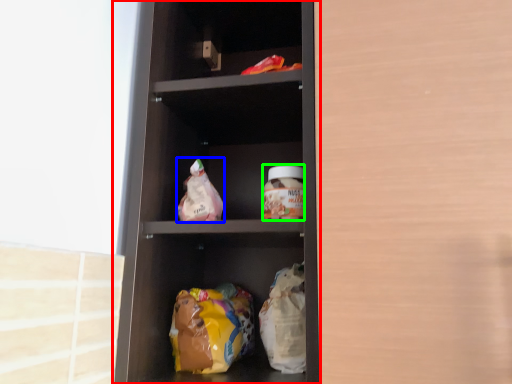
Question: Which is nearer to the shelf (highlighted by a red box)? snack (highlighted by a blue box) or glass jar (highlighted by a green box).

Choices:
 (A) snack
 (B) glass jar

Answer: (A)